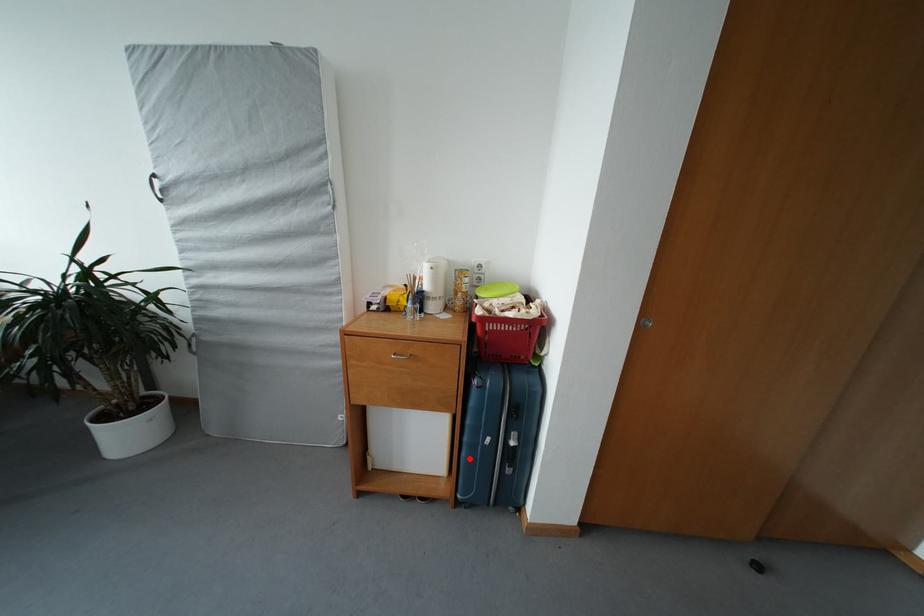
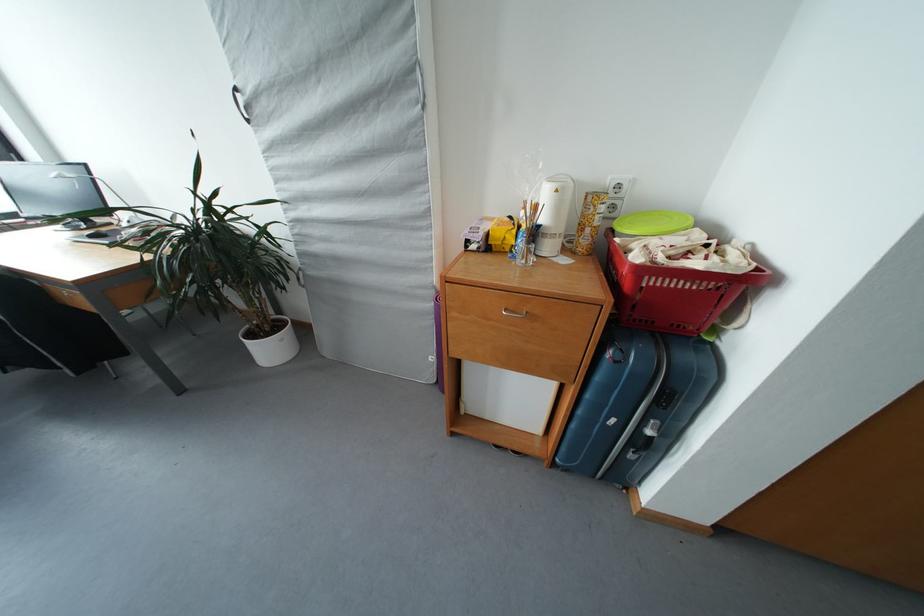
In the second image, find the point that corresponds to the highlighted location in the first image.

(579, 431)